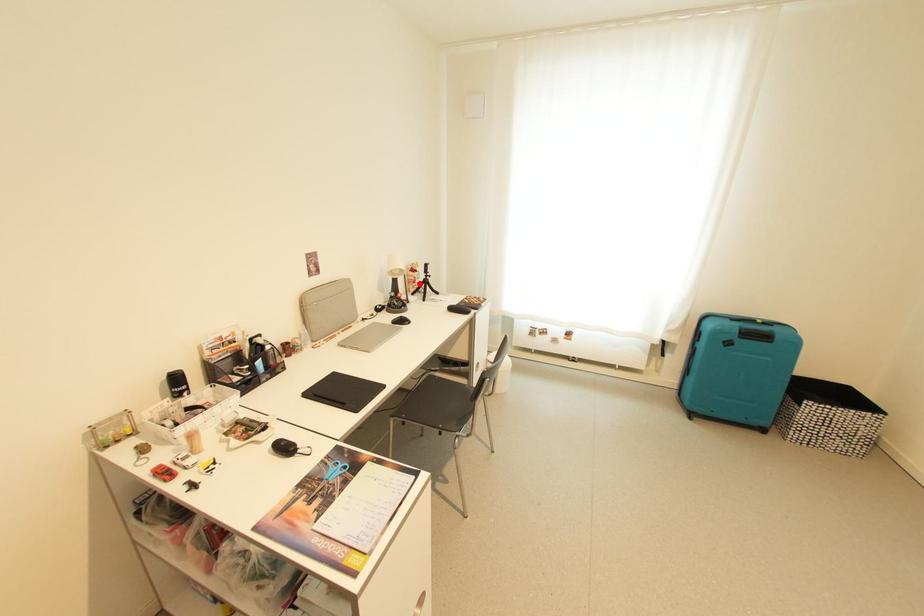
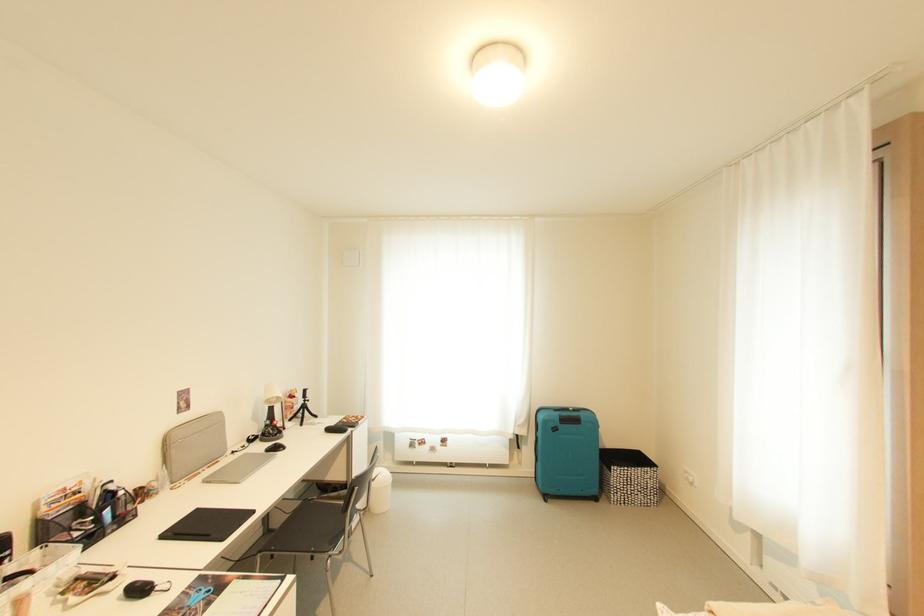
The point at the highlighted location is marked in the first image. Where is the corresponding point in the second image?

(297, 410)